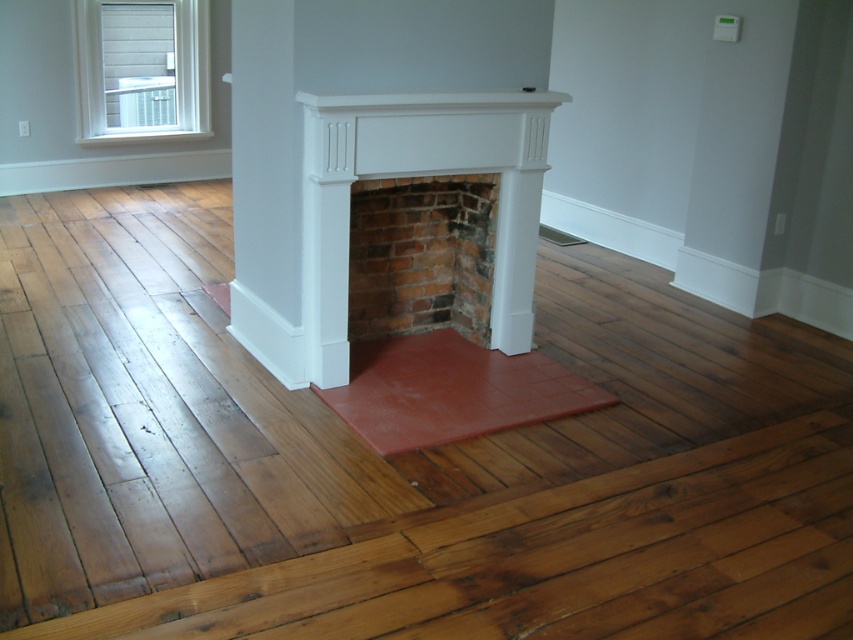
Question: Is white wood window at upper left positioned behind white matte fireplace mantel at upper center?

Choices:
 (A) yes
 (B) no

Answer: (A)

Question: Which of the following is the closest to the observer?

Choices:
 (A) shiny brown hardwood floor at center
 (B) brick at center
 (C) white painted brick fireplace at center
 (D) white wood window at upper left

Answer: (A)

Question: Does white painted brick fireplace at center appear under white wood window at upper left?

Choices:
 (A) no
 (B) yes

Answer: (B)

Question: Which of the following is the farthest from the observer?

Choices:
 (A) (397, 120)
 (B) (491, 262)
 (C) (178, 108)

Answer: (C)

Question: Which of the following is the closest to the observer?

Choices:
 (A) white wood window at upper left
 (B) white matte fireplace mantel at upper center
 (C) shiny brown hardwood floor at center
 (D) brick at center

Answer: (C)

Question: Is white wood window at upper left smaller than white matte fireplace mantel at upper center?

Choices:
 (A) yes
 (B) no

Answer: (B)